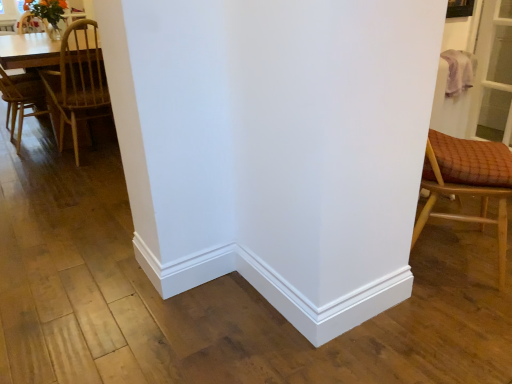
Where is `vacant space underneath wooden checkered cushion at right, the 1th chair in the right-to-left sequence (from a real-world perspective)`? Image resolution: width=512 pixels, height=384 pixels. vacant space underneath wooden checkered cushion at right, the 1th chair in the right-to-left sequence (from a real-world perspective) is located at coordinates (458, 249).